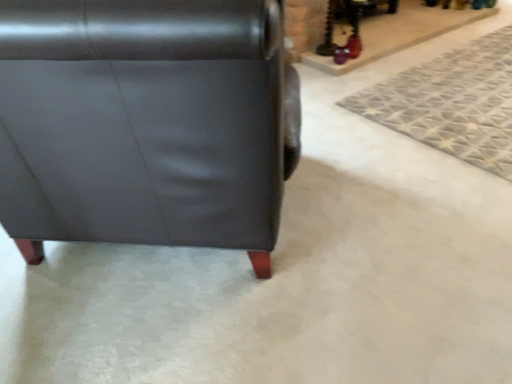
Describe the element at coordinates (146, 123) in the screenshot. I see `matte black leather chair at lower left` at that location.

You are a GUI agent. You are given a task and a screenshot of the screen. Output one action in this format:
    pyautogui.click(x=<x>, y=<y>)
    Task: Click on the matte black leather chair at lower left
    
    Given the screenshot: What is the action you would take?
    pyautogui.click(x=146, y=123)

The width and height of the screenshot is (512, 384). Identify the location of matte black leather chair at lower left. (146, 123).